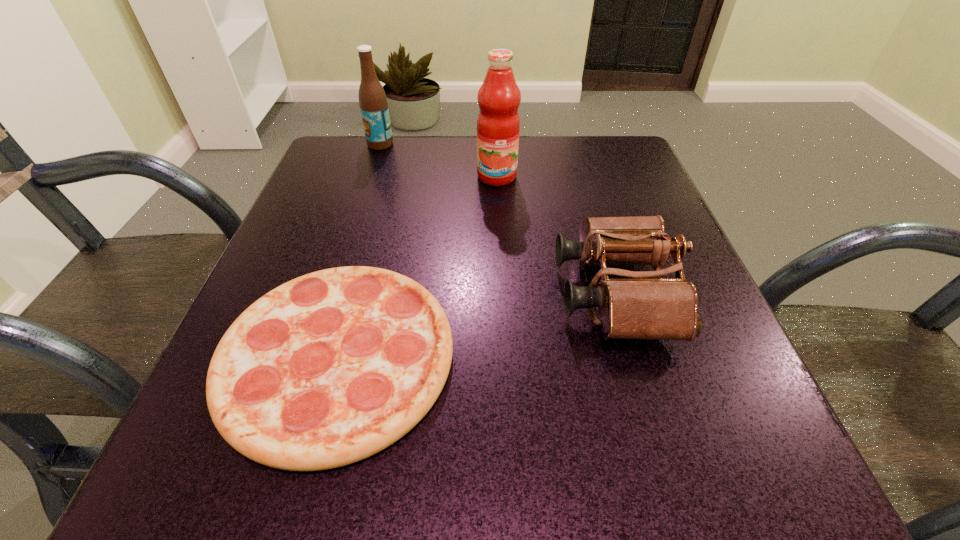
Locate an element on the screen. vacant space located 0.280m through the eyepieces of the rightmost object is located at coordinates (390, 294).

Locate an element on the screen. This screenshot has height=540, width=960. vacant region located through the eyepieces of the rightmost object is located at coordinates (348, 294).

Locate an element on the screen. The image size is (960, 540). free space located on the back of the shortest object is located at coordinates (368, 245).

At what (x,y) coordinates should I click in order to perform the action: click on fruit juice positioned at the far edge. Please return your answer as a coordinate pair (x, y). Image resolution: width=960 pixels, height=540 pixels. Looking at the image, I should click on (498, 123).

Identify the location of beer bottle at the far edge. (373, 103).

Identify the location of object situated at the near edge. This screenshot has height=540, width=960. (332, 367).

Locate an element on the screen. This screenshot has height=540, width=960. beer bottle at the left edge is located at coordinates (373, 103).

Locate an element on the screen. pizza present at the left edge is located at coordinates (332, 367).

Image resolution: width=960 pixels, height=540 pixels. I want to click on object located in the right edge section of the desktop, so click(642, 307).

This screenshot has width=960, height=540. I want to click on object situated at the far left corner, so [x=373, y=103].